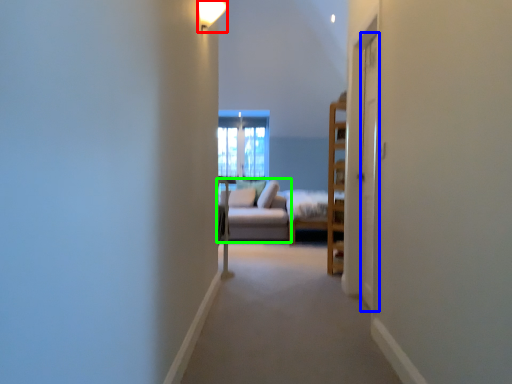
Question: Which is farther away from light fixture (highlighted by a red box)? screen door (highlighted by a blue box) or studio couch (highlighted by a green box)?

Choices:
 (A) screen door
 (B) studio couch

Answer: (B)